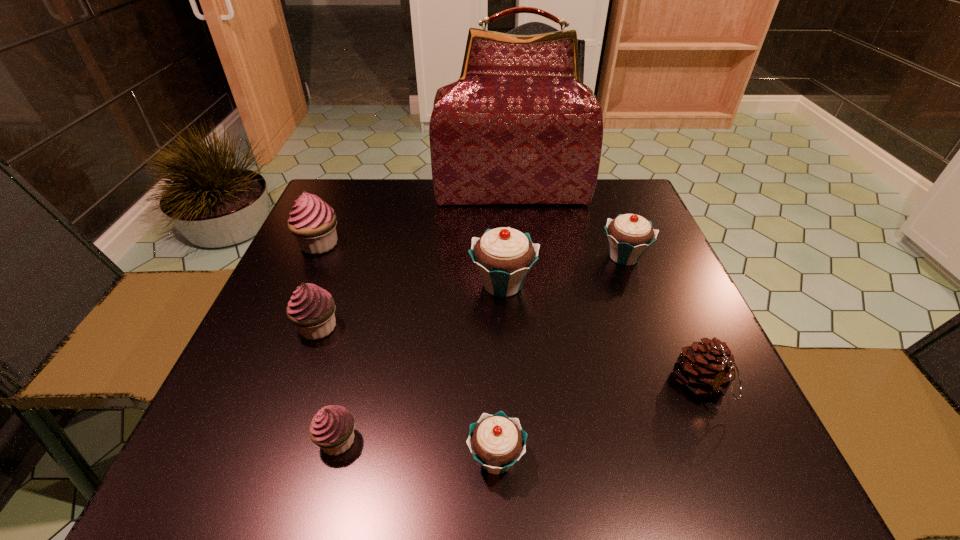
What are the coordinates of `unoccupied area between the biggest teal cupcake and the nearest teal cupcake` in the screenshot? It's located at (499, 371).

Point out which object is positioned as the sixth nearest to the rightmost cupcake. Please provide its 2D coordinates. Your answer should be formatted as a tuple, i.e. [(x, y)], where the tuple contains the x and y coordinates of a point satisfying the conditions above.

[(332, 429)]

Locate which object ranks in proximity to the farthest object. Please provide its 2D coordinates. Your answer should be formatted as a tuple, i.e. [(x, y)], where the tuple contains the x and y coordinates of a point satisfying the conditions above.

[(629, 235)]

At what (x,y) coordinates should I click in order to perform the action: click on cupcake object that ranks as the second closest to the biggest teal cupcake. Please return your answer as a coordinate pair (x, y). Image resolution: width=960 pixels, height=540 pixels. Looking at the image, I should click on (311, 308).

Where is `the fifth closest cupcake to the rightmost teal cupcake`? the fifth closest cupcake to the rightmost teal cupcake is located at coordinates (313, 222).

I want to click on pink cupcake that is the third closest to the biggest teal cupcake, so click(313, 222).

Identify which pink cupcake is the closest to the smallest teal cupcake. Please provide its 2D coordinates. Your answer should be formatted as a tuple, i.e. [(x, y)], where the tuple contains the x and y coordinates of a point satisfying the conditions above.

[(332, 429)]

Locate an element on the screen. The image size is (960, 540). teal cupcake that can be found as the third closest to the second farthest pink cupcake is located at coordinates (629, 235).

Choose which teal cupcake is the third nearest neighbor to the third object from left to right. Please provide its 2D coordinates. Your answer should be formatted as a tuple, i.e. [(x, y)], where the tuple contains the x and y coordinates of a point satisfying the conditions above.

[(629, 235)]

Find the location of a particular element. The width and height of the screenshot is (960, 540). free location that satisfies the following two spatial constraints: 1. on the front-facing side of the farthest object; 2. on the left side of the rightmost teal cupcake is located at coordinates pos(518,256).